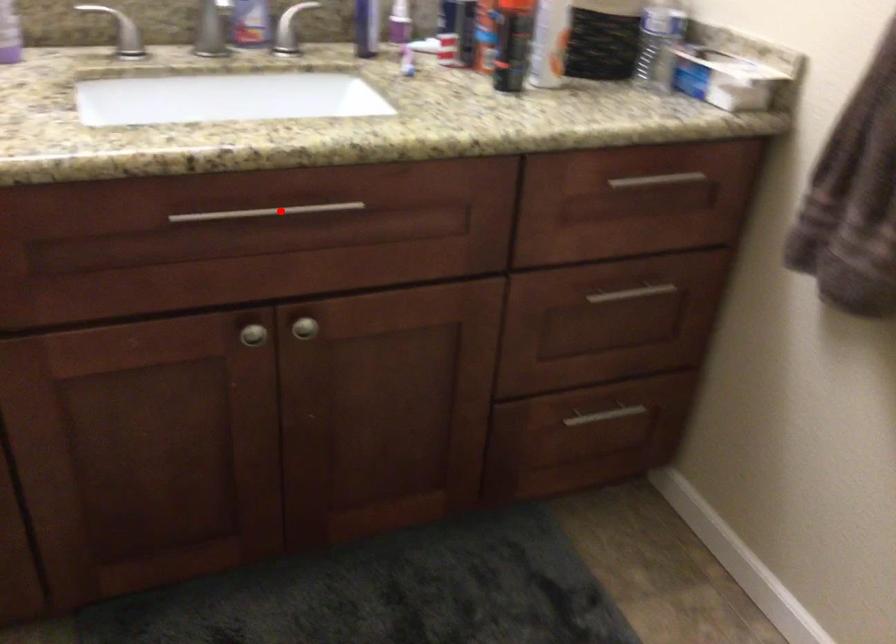
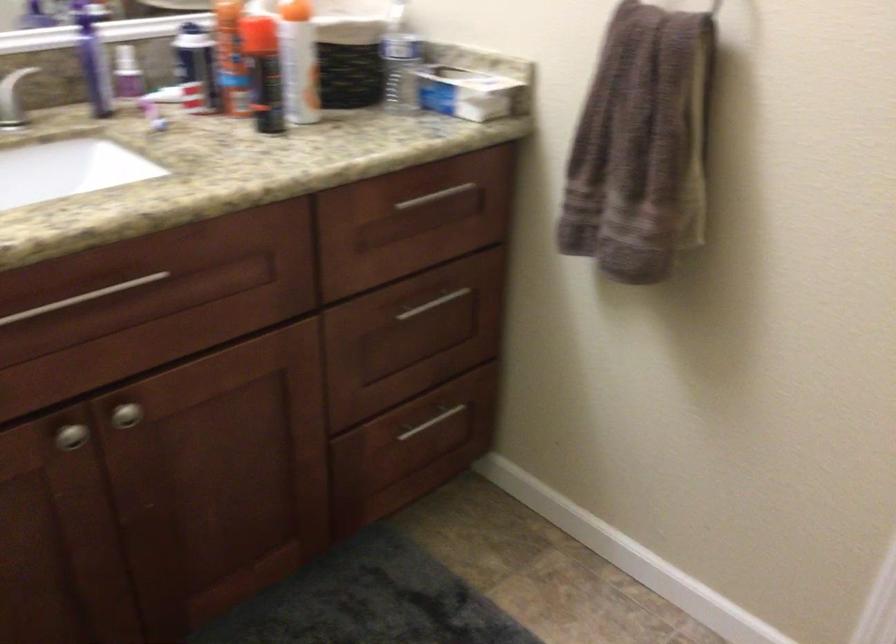
Locate, in the second image, the point that corresponds to the highlighted location in the first image.

(82, 298)